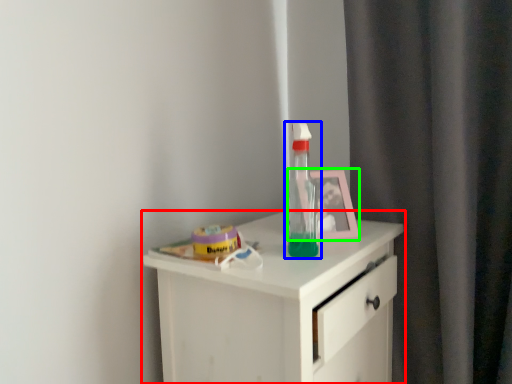
Question: Estimate the real-world distances between objects in this image. Which object is closer to chest of drawers (highlighted by a red box), bottle (highlighted by a blue box) or picture frame (highlighted by a green box)?

Choices:
 (A) bottle
 (B) picture frame

Answer: (A)